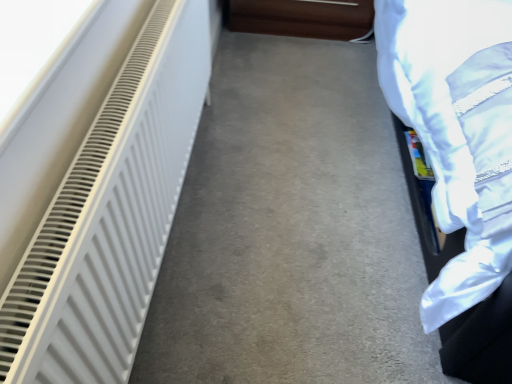
In order to click on unoccupied space behind white matte radiator at left in this screenshot , I will do `click(272, 132)`.